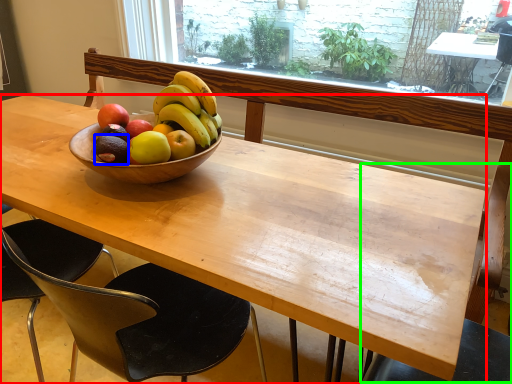
Question: Which is farther away from desk (highlighted by a red box)? avocado (highlighted by a blue box) or chair (highlighted by a green box)?

Choices:
 (A) avocado
 (B) chair

Answer: (B)